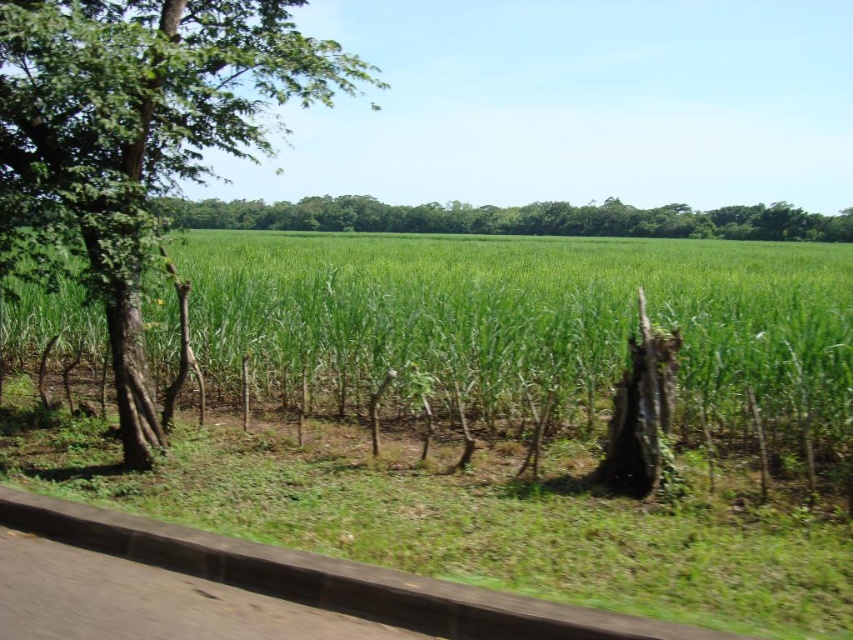
Question: Which point appears closest to the camera in this image?

Choices:
 (A) (498, 401)
 (B) (399, 220)
 (C) (181, 81)

Answer: (C)

Question: Is green grassy field at center to the left of green leafy tree at left from the viewer's perspective?

Choices:
 (A) no
 (B) yes

Answer: (A)

Question: Among these points, which one is nearest to the camera?

Choices:
 (A) (96, 256)
 (B) (820, 323)
 (C) (717, 211)

Answer: (A)

Question: Can you confirm if green grassy field at center is wider than green leafy tree at left?

Choices:
 (A) no
 (B) yes

Answer: (B)

Question: Does green grassy field at center have a greater width compared to green leafy tree at center?

Choices:
 (A) yes
 (B) no

Answer: (B)

Question: Estimate the real-world distances between objects in this image. Which object is closer to the green grassy field at center?

Choices:
 (A) green leafy tree at center
 (B) green leafy tree at left

Answer: (B)